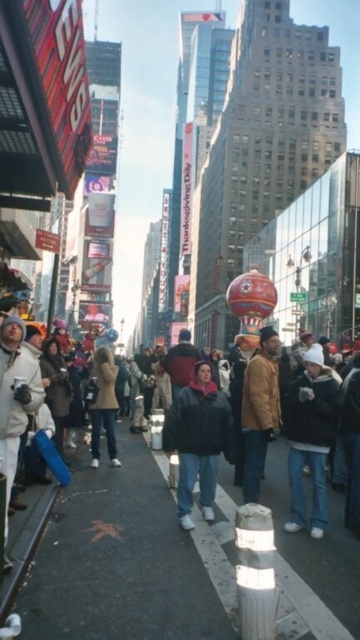
You are a pedestrian standing on the concrete sidewalk at center. You want to walk towards the white fleece jacket at center. Is the jacket in front of or behind you?

The concrete sidewalk at center is in front of the white fleece jacket at center, so the jacket is behind you.

In the scene shown: You are a photographer trying to capture a shot of the dark gray jacket at center and the dark brown leather jacket at center in the crowd. Since you want both jackets to be clearly visible in your photo, which jacket should you focus on first to ensure it doesn t get cropped out?

The dark gray jacket at center is much taller than the dark brown leather leather jacket at center, so you should focus on the dark gray jacket at center first to ensure it doesn t get cropped out due to its greater height.

What are the coordinates of the dark gray jacket at center?

The dark gray jacket at center is located at coordinates [15,365].